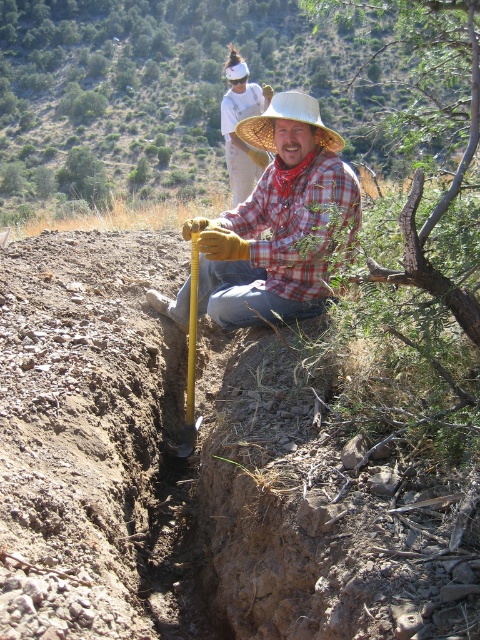
Is woven straw cowboy hat at center behind yellow plastic shovel at center?

Yes, it is.

Which is behind, point (238, 134) or point (190, 401)?

Point (238, 134)

Describe the element at coordinates (286, 118) in the screenshot. I see `woven straw cowboy hat at center` at that location.

The width and height of the screenshot is (480, 640). I want to click on woven straw cowboy hat at center, so (286, 118).

Is matte plaid shirt at center to the left of white cotton shirt at upper center from the viewer's perspective?

No, matte plaid shirt at center is not to the left of white cotton shirt at upper center.

This screenshot has width=480, height=640. Describe the element at coordinates (277, 221) in the screenshot. I see `matte plaid shirt at center` at that location.

Does point (336, 168) come in front of point (233, 81)?

That is True.

Find the location of `matte plaid shirt at center`. matte plaid shirt at center is located at coordinates (277, 221).

Between point (93, 76) and point (268, 108), which one is positioned in front?

Point (268, 108)

This screenshot has width=480, height=640. Find the location of `green leafy tree at upper center`. green leafy tree at upper center is located at coordinates click(x=158, y=88).